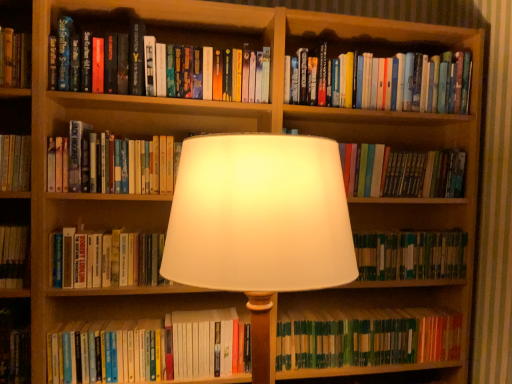
Question: Relative to hardcover book at center, which is counted as the 5th book, starting from the top, is green matte book at center, the third book from the bottom, in front or behind?

Choices:
 (A) front
 (B) behind

Answer: (B)

Question: Which is correct: green matte book at center, the third book from the bottom, is inside hardcover book at center, which is counted as the 5th book, starting from the top, or outside of it?

Choices:
 (A) outside
 (B) inside

Answer: (A)

Question: Which object is positioned closest to the hardcover books at upper left, positioned as the first book in top-to-bottom order?

Choices:
 (A) hardcover book at center, which is the 4th book from top to bottom
 (B) white fabric lampshade at center
 (C) hardcover book at center, which is counted as the 5th book, starting from the top
 (D) hardcover books at lower center, the second book from the bottom
 (E) green matte book at center, which ranks as the 6th book in top-to-bottom order

Answer: (A)

Question: Estimate the real-world distances between objects in this image. Which object is farther from the green matte book at center, the third book from the bottom?

Choices:
 (A) hardcover books at upper right, the seventh book from the bottom
 (B) hardcover book at center, the fourth book in the bottom-to-top sequence
 (C) green matte book at lower right, the 8th book positioned from the top
 (D) hardcover book at center, which is the 4th book from top to bottom
 (E) hardcover books at lower center, the second book from the bottom

Answer: (B)